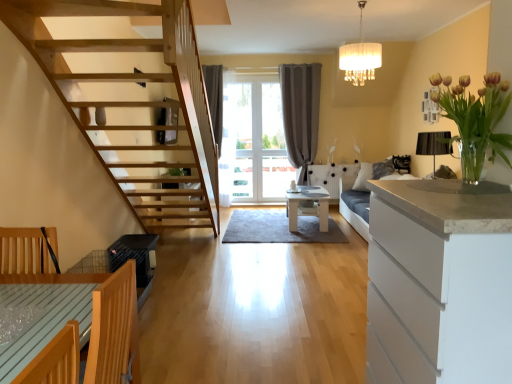
Question: Is white fabric lampshade at upper center thinner than white matte cabinet at right?

Choices:
 (A) yes
 (B) no

Answer: (A)

Question: Does white fabric lampshade at upper center come behind white matte cabinet at right?

Choices:
 (A) yes
 (B) no

Answer: (A)

Question: Is white matte cabinet at right a part of white fabric lampshade at upper center?

Choices:
 (A) yes
 (B) no

Answer: (B)

Question: Can you confirm if white fabric lampshade at upper center is smaller than white matte cabinet at right?

Choices:
 (A) no
 (B) yes

Answer: (B)

Question: Considering the relative sizes of white fabric lampshade at upper center and white matte cabinet at right in the image provided, is white fabric lampshade at upper center wider than white matte cabinet at right?

Choices:
 (A) yes
 (B) no

Answer: (B)

Question: In the image, is white matte cabinet at right on the left side or the right side of white glossy table at center, the second table when ordered from left to right?

Choices:
 (A) left
 (B) right

Answer: (B)

Question: From a real-world perspective, is white matte cabinet at right positioned above or below white glossy table at center, which is the 1th table in top-to-bottom order?

Choices:
 (A) below
 (B) above

Answer: (B)

Question: Looking at their shapes, would you say white matte cabinet at right is wider or thinner than white glossy table at center, the second table when ordered from left to right?

Choices:
 (A) wide
 (B) thin

Answer: (B)

Question: Relative to white glossy table at center, the second table when ordered from left to right, is white matte cabinet at right in front or behind?

Choices:
 (A) behind
 (B) front

Answer: (B)

Question: From the image's perspective, is white glossy table at center, positioned as the 1th table in right-to-left order, above or below gray fabric curtain at center?

Choices:
 (A) above
 (B) below

Answer: (B)

Question: Is white glossy table at center, which is the 1th table in top-to-bottom order, in front of or behind gray fabric curtain at center in the image?

Choices:
 (A) behind
 (B) front

Answer: (B)

Question: Looking at their shapes, would you say white glossy table at center, which is the 1th table in top-to-bottom order, is wider or thinner than gray fabric curtain at center?

Choices:
 (A) thin
 (B) wide

Answer: (B)

Question: Looking at the image, does white glossy table at center, the second table when ordered from left to right, seem bigger or smaller compared to gray fabric curtain at center?

Choices:
 (A) small
 (B) big

Answer: (A)

Question: Considering their positions, is white matte cabinet at right located in front of or behind light brown wooden table at lower left, positioned as the 1th table in bottom-to-top order?

Choices:
 (A) behind
 (B) front

Answer: (B)

Question: In terms of height, does white matte cabinet at right look taller or shorter compared to light brown wooden table at lower left, the second table when ordered from back to front?

Choices:
 (A) tall
 (B) short

Answer: (A)